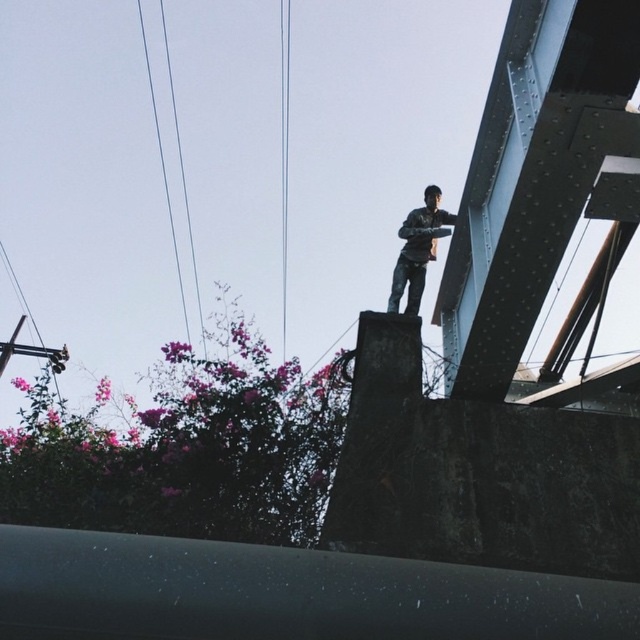
Consider the image. Measure the distance between point (x=193, y=252) and camera.

Point (x=193, y=252) is 33.81 feet from camera.

Identify the location of black wire at upper left. The height and width of the screenshot is (640, 640). (163, 168).

Identify the location of dark gray jeans at center. (419, 250).

In the scene shown: Who is more forward, [400,228] or [284,285]?

Point [400,228] is more forward.

Between point (412, 268) and point (282, 140), which one is positioned behind?

Point (282, 140)

This screenshot has width=640, height=640. What are the coordinates of `dark gray jeans at center` in the screenshot? It's located at (419, 250).

Is dark gray jeans at center in front of black wire at upper left?

Yes.

Can you confirm if dark gray jeans at center is shorter than black wire at upper left?

No.

Who is more distant from viewer, (432, 234) or (170, 77)?

Point (170, 77)

Locate an element on the screen. dark gray jeans at center is located at coordinates (419, 250).